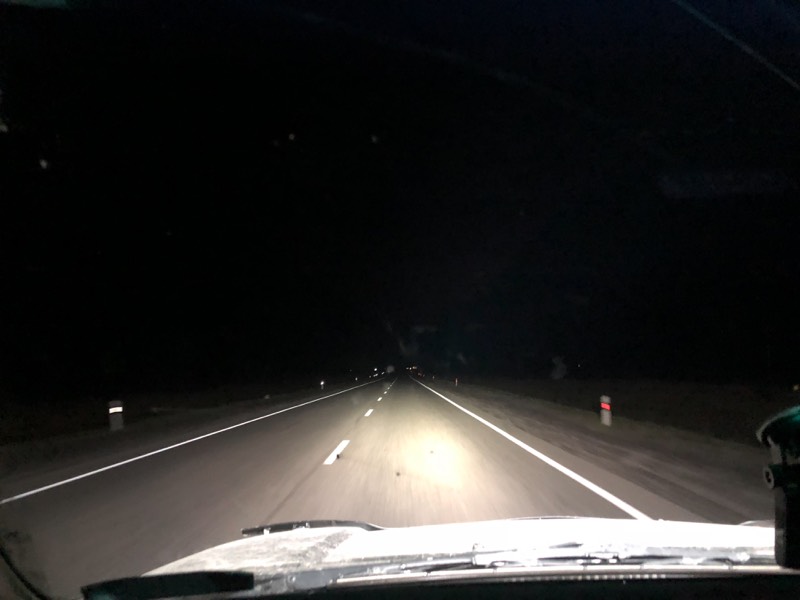
Locate an element on the screen. Image resolution: width=800 pixels, height=600 pixels. phone holder is located at coordinates (782, 520).